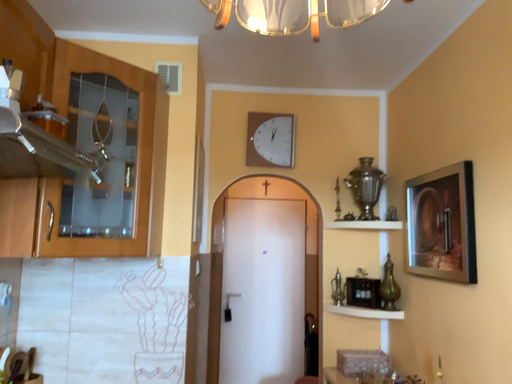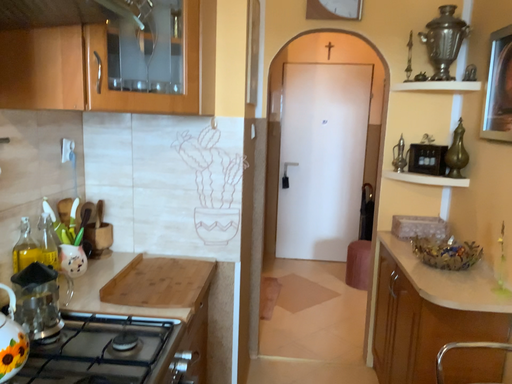
Question: How did the camera likely rotate when shooting the video?

Choices:
 (A) rotated downward
 (B) rotated upward

Answer: (A)